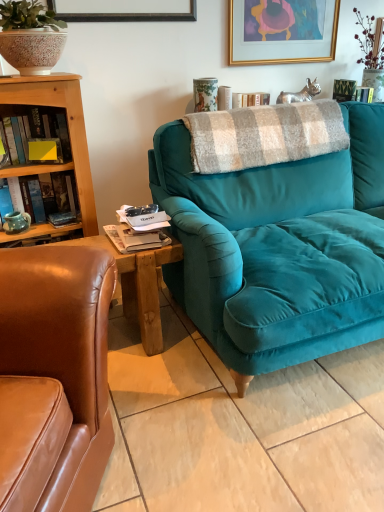
This screenshot has width=384, height=512. What do you see at coordinates (279, 247) in the screenshot?
I see `teal velvet couch at center` at bounding box center [279, 247].

Identify the location of teal velvet couch at center. The image size is (384, 512). (279, 247).

Describe the element at coordinates (282, 31) in the screenshot. This screenshot has height=512, width=384. I see `gold-framed artwork at upper center` at that location.

Describe the element at coordinates (38, 130) in the screenshot. I see `yellow matte sticky note at left, the first book in the top-to-bottom sequence` at that location.

Image resolution: width=384 pixels, height=512 pixels. Find the location of `teal matte mug at left, acting as the first book starting from the bottom`. teal matte mug at left, acting as the first book starting from the bottom is located at coordinates (25, 179).

The width and height of the screenshot is (384, 512). Describe the element at coordinates (25, 179) in the screenshot. I see `teal matte mug at left, acting as the first book starting from the bottom` at that location.

The height and width of the screenshot is (512, 384). I want to click on matte ceramic mug at left, so click(x=16, y=222).

The height and width of the screenshot is (512, 384). I want to click on plaid woolen blanket at center, so click(264, 135).

What's the angular difference between gold-framed artwork at upper center and plaid woolen blanket at center's facing directions?

They differ by 2.05 degrees in their facing directions.

Is gold-framed artwork at upper center turned away from plaid woolen blanket at center?

No.

Considering the relative positions of gold-framed artwork at upper center and plaid woolen blanket at center in the image provided, is gold-framed artwork at upper center behind plaid woolen blanket at center?

Yes, it is.

Between gold-framed artwork at upper center and plaid woolen blanket at center, which one has smaller size?

gold-framed artwork at upper center.

Between teal matte mug at left, which is counted as the second book, starting from the top, and teal velvet couch at center, which one has smaller size?

teal matte mug at left, which is counted as the second book, starting from the top, is smaller.

Based on their positions, is teal matte mug at left, which is counted as the second book, starting from the top, located to the left or right of teal velvet couch at center?

Clearly, teal matte mug at left, which is counted as the second book, starting from the top, is on the left of teal velvet couch at center in the image.

From the image's perspective, is teal matte mug at left, acting as the first book starting from the bottom, below teal velvet couch at center?

No, from the image's perspective, teal matte mug at left, acting as the first book starting from the bottom, is not beneath teal velvet couch at center.

Are teal matte mug at left, acting as the first book starting from the bottom, and teal velvet couch at center located far from each other?

No.

Is teal velvet couch at center to the right of gold-framed artwork at upper center from the viewer's perspective?

Yes, teal velvet couch at center is to the right of gold-framed artwork at upper center.

From a real-world perspective, is teal velvet couch at center located beneath gold-framed artwork at upper center?

Yes, from a real-world perspective, teal velvet couch at center is below gold-framed artwork at upper center.

Considering the relative sizes of teal velvet couch at center and gold-framed artwork at upper center in the image provided, is teal velvet couch at center shorter than gold-framed artwork at upper center?

Incorrect, the height of teal velvet couch at center does not fall short of that of gold-framed artwork at upper center.

At what (x,y) coordinates should I click in order to perform the action: click on studio couch in front of the gold-framed artwork at upper center. Please return your answer as a coordinate pair (x, y). The width and height of the screenshot is (384, 512). Looking at the image, I should click on (279, 247).

Is teal velvet couch at center thinner than plaid woolen blanket at center?

No, teal velvet couch at center is not thinner than plaid woolen blanket at center.

Is teal velvet couch at center to the left of plaid woolen blanket at center from the viewer's perspective?

In fact, teal velvet couch at center is to the right of plaid woolen blanket at center.

Does teal velvet couch at center have a lesser height compared to plaid woolen blanket at center?

In fact, teal velvet couch at center may be taller than plaid woolen blanket at center.

Is gold-framed artwork at upper center behind matte ceramic mug at left?

Yes, gold-framed artwork at upper center is behind matte ceramic mug at left.

Is gold-framed artwork at upper center wider or thinner than matte ceramic mug at left?

Considering their sizes, gold-framed artwork at upper center looks slimmer than matte ceramic mug at left.

Considering the sizes of objects gold-framed artwork at upper center and matte ceramic mug at left in the image provided, who is bigger, gold-framed artwork at upper center or matte ceramic mug at left?

gold-framed artwork at upper center is bigger.

Between matte ceramic mug at left and gold-framed artwork at upper center, which one has smaller width?

Thinner between the two is gold-framed artwork at upper center.

In the scene shown: Is matte ceramic mug at left positioned with its back to gold-framed artwork at upper center?

matte ceramic mug at left does not have its back to gold-framed artwork at upper center.

How much distance is there between matte ceramic mug at left and gold-framed artwork at upper center?

They are 5.37 feet apart.

From the image's perspective, between matte ceramic mug at left and gold-framed artwork at upper center, which one is located above?

gold-framed artwork at upper center.

How different are the orientations of plaid woolen blanket at center and teal matte mug at left, which is counted as the second book, starting from the top, in degrees?

plaid woolen blanket at center and teal matte mug at left, which is counted as the second book, starting from the top, are facing 7.78 degrees away from each other.

Which of these two, plaid woolen blanket at center or teal matte mug at left, which is counted as the second book, starting from the top, is thinner?

teal matte mug at left, which is counted as the second book, starting from the top, is thinner.

Would you consider plaid woolen blanket at center to be distant from teal matte mug at left, which is counted as the second book, starting from the top?

They are positioned close to each other.

Considering the relative positions of plaid woolen blanket at center and teal matte mug at left, acting as the first book starting from the bottom, in the image provided, is plaid woolen blanket at center to the left of teal matte mug at left, acting as the first book starting from the bottom, from the viewer's perspective?

In fact, plaid woolen blanket at center is to the right of teal matte mug at left, acting as the first book starting from the bottom.

What are the coordinates of `picture frame above the plaid woolen blanket at center (from the image's perspective)` in the screenshot? It's located at (282, 31).

Where is `studio couch that appears in front of the teal matte mug at left, which is counted as the second book, starting from the top`? This screenshot has height=512, width=384. studio couch that appears in front of the teal matte mug at left, which is counted as the second book, starting from the top is located at coordinates (279, 247).

From the image, which object appears to be nearer to gold-framed artwork at upper center, yellow matte sticky note at left, the first book in the top-to-bottom sequence, or teal velvet couch at center?

teal velvet couch at center.

From the image, which object appears to be farther from plaid woolen blanket at center, gold-framed artwork at upper center or matte ceramic mug at left?

The object further to plaid woolen blanket at center is matte ceramic mug at left.

Consider the image. Based on their spatial positions, is teal velvet couch at center or matte ceramic mug at left closer to yellow matte sticky note at left, the second book in the bottom-to-top sequence?

matte ceramic mug at left is positioned closer to the anchor yellow matte sticky note at left, the second book in the bottom-to-top sequence.

Estimate the real-world distances between objects in this image. Which object is closer to gold-framed artwork at upper center, matte ceramic mug at left or plaid woolen blanket at center?

plaid woolen blanket at center is closer to gold-framed artwork at upper center.

Which object lies further to the anchor point teal velvet couch at center, teal matte mug at left, which is counted as the second book, starting from the top, or yellow matte sticky note at left, the second book in the bottom-to-top sequence?

teal matte mug at left, which is counted as the second book, starting from the top, lies further to teal velvet couch at center than the other object.

Consider the image. Looking at the image, which one is located further to gold-framed artwork at upper center, plaid woolen blanket at center or teal velvet couch at center?

teal velvet couch at center is further to gold-framed artwork at upper center.

Considering their positions, is yellow matte sticky note at left, the first book in the top-to-bottom sequence, positioned closer to teal matte mug at left, acting as the first book starting from the bottom, than gold-framed artwork at upper center?

yellow matte sticky note at left, the first book in the top-to-bottom sequence.

Based on the photo, estimate the real-world distances between objects in this image. Which object is further from teal matte mug at left, which is counted as the second book, starting from the top, plaid woolen blanket at center or teal velvet couch at center?

The object further to teal matte mug at left, which is counted as the second book, starting from the top, is teal velvet couch at center.

In order to click on book between yellow matte sticky note at left, the second book in the bottom-to-top sequence, and matte ceramic mug at left, in the vertical direction in this screenshot , I will do `click(25, 179)`.

Find the location of a particular element. Image resolution: width=384 pixels, height=512 pixels. blanket between yellow matte sticky note at left, the first book in the top-to-bottom sequence, and gold-framed artwork at upper center is located at coordinates tap(264, 135).

You are a GUI agent. You are given a task and a screenshot of the screen. Output one action in this format:
    pyautogui.click(x=<x>, y=<y>)
    Task: Click on the picture frame located between yellow matte sticky note at left, the second book in the bottom-to-top sequence, and teal velvet couch at center in the left-right direction
    This screenshot has width=384, height=512.
    Given the screenshot: What is the action you would take?
    pyautogui.click(x=282, y=31)

You are a GUI agent. You are given a task and a screenshot of the screen. Output one action in this format:
    pyautogui.click(x=<x>, y=<y>)
    Task: Click on the book between teal matte mug at left, acting as the first book starting from the bottom, and plaid woolen blanket at center
    The width and height of the screenshot is (384, 512).
    Given the screenshot: What is the action you would take?
    pyautogui.click(x=38, y=130)